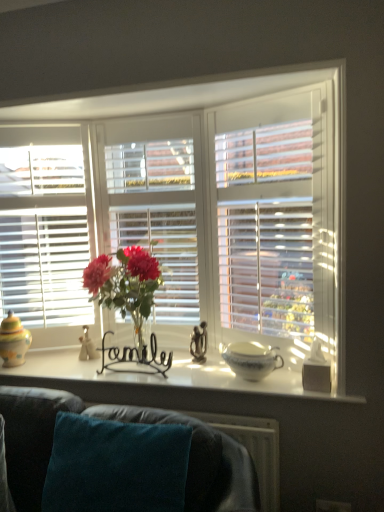
Locate an element on the screen. The image size is (384, 512). free space to the right of black wire at center, positioned as the second candle holder in right-to-left order is located at coordinates (181, 370).